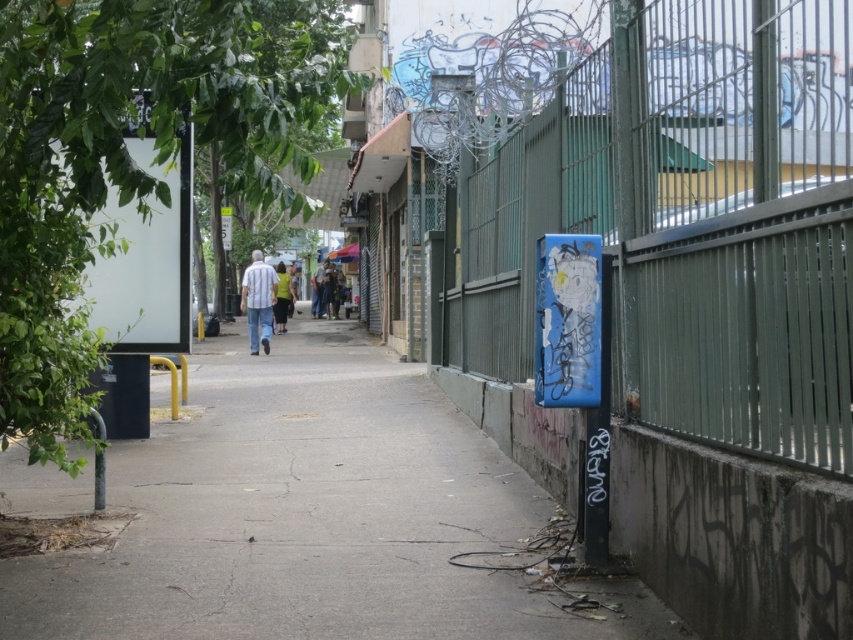
You are a person standing on the sidewalk in the urban street scene. You notice a striped fabric shirt at center and a matte gray pants at center. Which clothing item appears bigger in the image?

The striped fabric shirt at center is larger in size than the matte gray pants at center, so the striped fabric shirt at center appears bigger in the image.

You are a delivery person carrying a package that is 1.8 meters tall. You need to walk through the area between the green metal fence at right and the transparent plastic umbrella at center. Will the package fit vertically in this space?

The green metal fence at right has a lesser height compared to transparent plastic umbrella at center. Since the package is 1.8 meters tall, the transparent plastic umbrella at center is taller than the fence, so the package might not fit under the umbrella but could potentially pass over the fence. However, the fence itself is shorter, so the package may clear it, but the umbrella might be an obstruction depending on its exact height. Without specific measurements, it is uncertain.